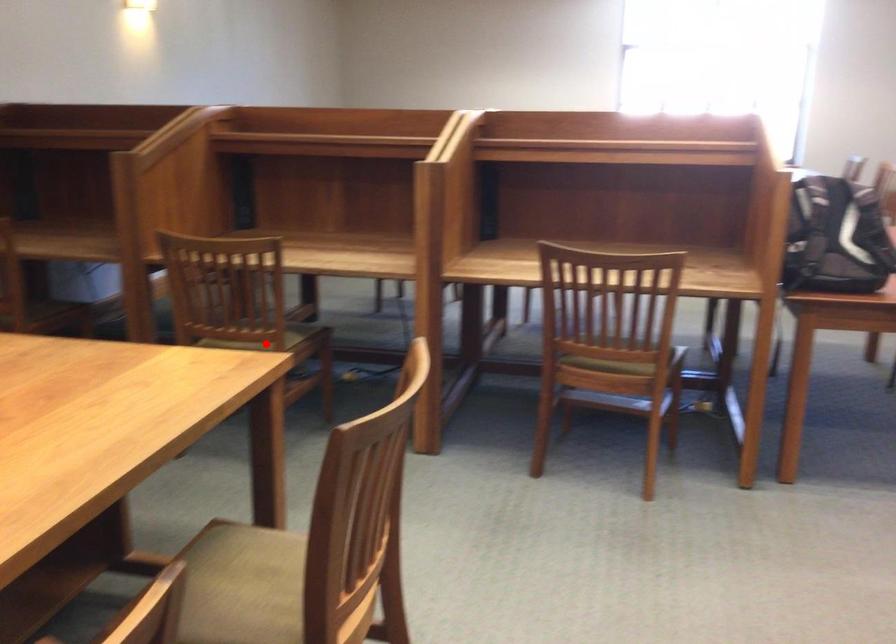
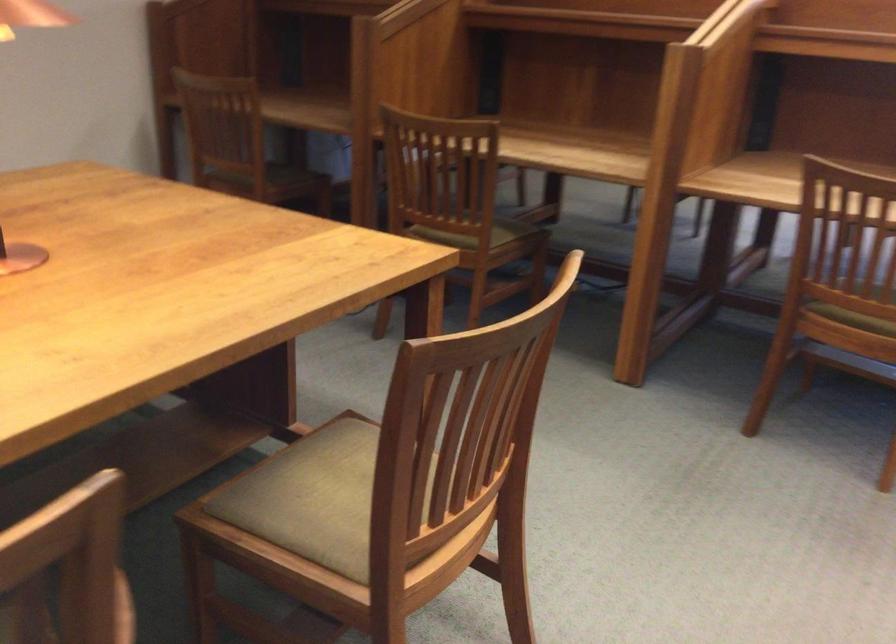
The point at the highlighted location is marked in the first image. Where is the corresponding point in the second image?

(474, 234)